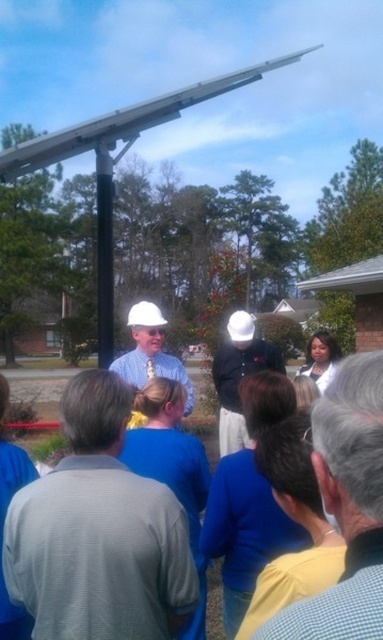
Is gray textured shirt at center bigger than matte white hard hat at center?

No.

Is point (165, 609) closer to camera compared to point (148, 326)?

Yes, point (165, 609) is closer to viewer.

Image resolution: width=383 pixels, height=640 pixels. What do you see at coordinates (98, 532) in the screenshot? I see `gray textured shirt at center` at bounding box center [98, 532].

This screenshot has height=640, width=383. I want to click on gray textured shirt at center, so click(98, 532).

Where is `matte black hard hat at center`? The width and height of the screenshot is (383, 640). matte black hard hat at center is located at coordinates coord(238,376).

Which is behind, point (224, 451) or point (140, 304)?

Point (224, 451)

What do you see at coordinates (238, 376) in the screenshot? I see `matte black hard hat at center` at bounding box center [238, 376].

The image size is (383, 640). I want to click on matte black hard hat at center, so 238,376.

Is light blue shirt at center in front of matte black hard hat at center?

Yes, light blue shirt at center is in front of matte black hard hat at center.

Measure the distance between point (363, 483) and camera.

A distance of 27.99 inches exists between point (363, 483) and camera.

Is point (330, 410) closer to viewer compared to point (242, 323)?

Yes, it is.

I want to click on light blue shirt at center, so click(345, 506).